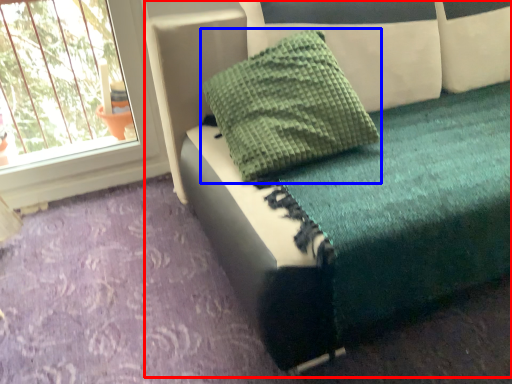
Question: Among these objects, which one is farthest to the camera, furniture (highlighted by a red box) or pillow (highlighted by a blue box)?

Choices:
 (A) furniture
 (B) pillow

Answer: (B)